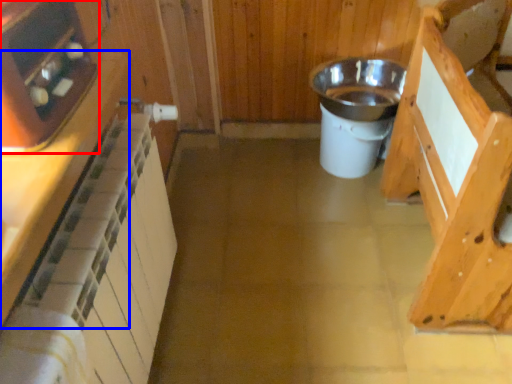
Question: Which of the following is the closest to the observer, appliance (highlighted by a red box) or cabinetry (highlighted by a blue box)?

Choices:
 (A) appliance
 (B) cabinetry

Answer: (B)